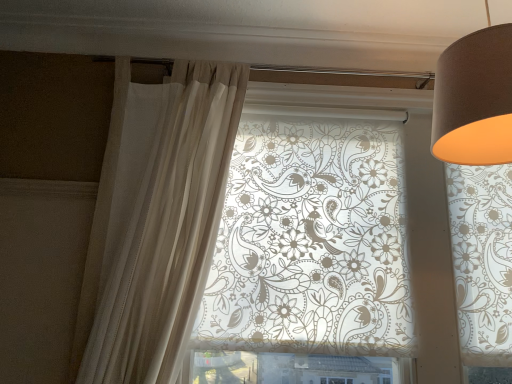
Question: Which direction should I rotate to look at translucent floral-patterned roller blind at center?

Choices:
 (A) right
 (B) left

Answer: (A)

Question: Is sheer white curtain at left surrounded by translucent floral-patterned roller blind at center?

Choices:
 (A) no
 (B) yes

Answer: (A)

Question: Does translucent floral-patterned roller blind at center have a lesser width compared to sheer white curtain at left?

Choices:
 (A) no
 (B) yes

Answer: (A)

Question: Considering the relative positions of translucent floral-patterned roller blind at center and sheer white curtain at left in the image provided, is translucent floral-patterned roller blind at center to the left of sheer white curtain at left from the viewer's perspective?

Choices:
 (A) yes
 (B) no

Answer: (B)

Question: From the image's perspective, is translucent floral-patterned roller blind at center located above sheer white curtain at left?

Choices:
 (A) yes
 (B) no

Answer: (B)

Question: From the image's perspective, does translucent floral-patterned roller blind at center appear lower than sheer white curtain at left?

Choices:
 (A) yes
 (B) no

Answer: (A)

Question: Is translucent floral-patterned roller blind at center far away from sheer white curtain at left?

Choices:
 (A) yes
 (B) no

Answer: (B)

Question: Does matte brown lampshade at upper right have a lesser width compared to translucent floral-patterned roller blind at center?

Choices:
 (A) no
 (B) yes

Answer: (A)

Question: From a real-world perspective, does matte brown lampshade at upper right sit lower than translucent floral-patterned roller blind at center?

Choices:
 (A) no
 (B) yes

Answer: (A)

Question: Is translucent floral-patterned roller blind at center at the back of matte brown lampshade at upper right?

Choices:
 (A) yes
 (B) no

Answer: (A)

Question: From the image's perspective, is matte brown lampshade at upper right on top of translucent floral-patterned roller blind at center?

Choices:
 (A) no
 (B) yes

Answer: (B)

Question: Does matte brown lampshade at upper right have a lesser height compared to translucent floral-patterned roller blind at center?

Choices:
 (A) no
 (B) yes

Answer: (B)

Question: Could you tell me if matte brown lampshade at upper right is facing translucent floral-patterned roller blind at center?

Choices:
 (A) no
 (B) yes

Answer: (A)

Question: From the image's perspective, is translucent floral-patterned roller blind at center located beneath matte brown lampshade at upper right?

Choices:
 (A) no
 (B) yes

Answer: (B)